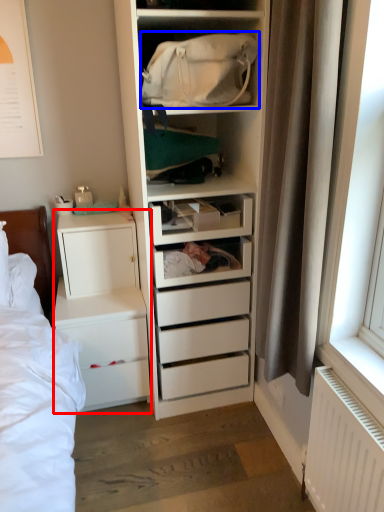
Question: Which object appears closest to the camera in this image, chest of drawers (highlighted by a red box) or bag (highlighted by a blue box)?

Choices:
 (A) chest of drawers
 (B) bag

Answer: (B)